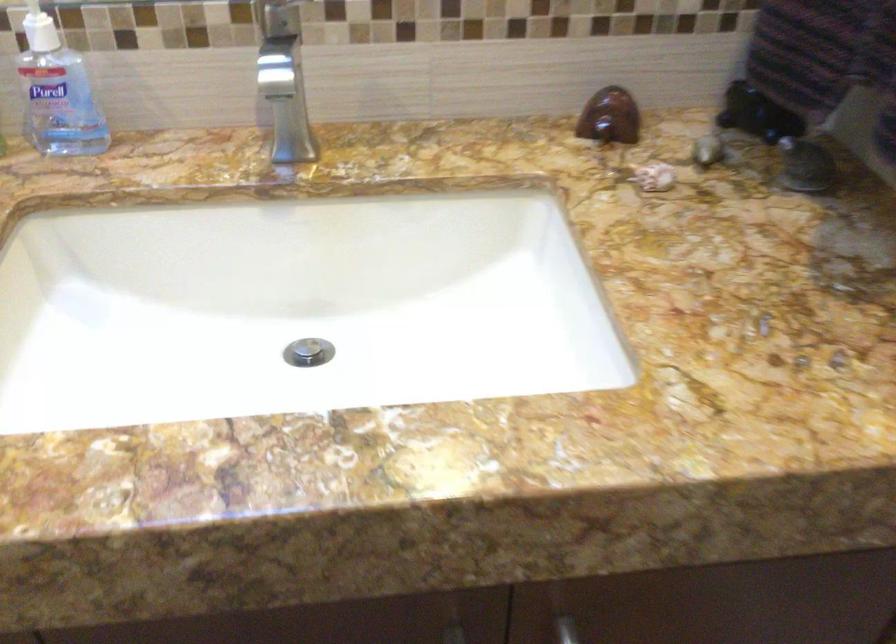
The width and height of the screenshot is (896, 644). Describe the element at coordinates (307, 352) in the screenshot. I see `the sink drain stopper` at that location.